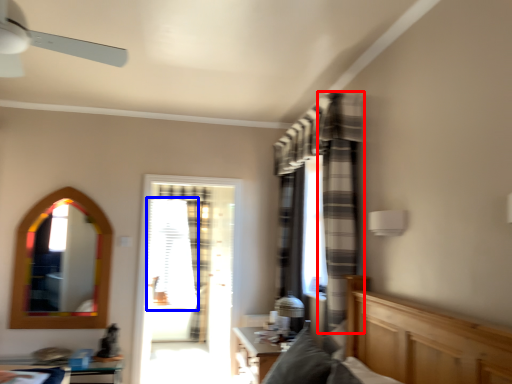
Question: Among these objects, which one is nearest to the camera, curtain (highlighted by a red box) or window screen (highlighted by a blue box)?

Choices:
 (A) curtain
 (B) window screen

Answer: (A)